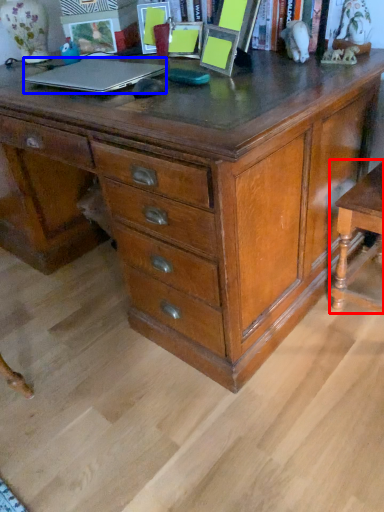
Question: Which point is closer to the camera, table (highlighted by a red box) or laptop (highlighted by a blue box)?

Choices:
 (A) table
 (B) laptop

Answer: (A)